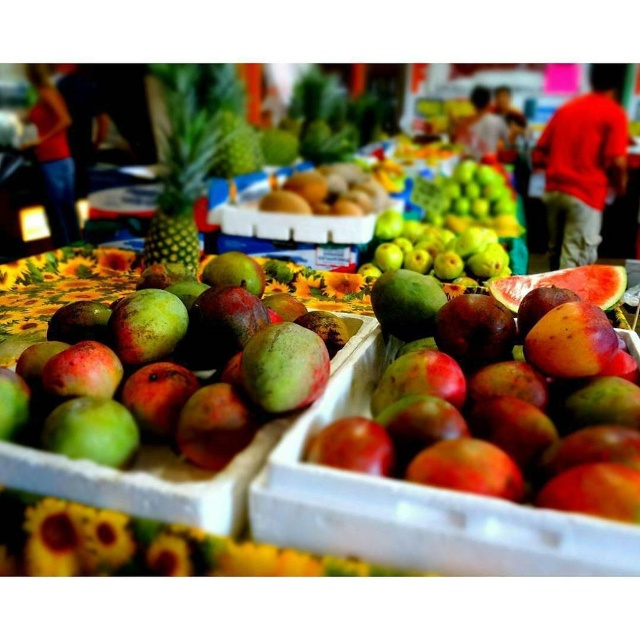
Question: Can you confirm if ripe mango at center is positioned to the right of green matte mango at center?

Choices:
 (A) no
 (B) yes

Answer: (B)

Question: Can you confirm if ripe mango at center is positioned to the left of green matte mango at center?

Choices:
 (A) no
 (B) yes

Answer: (A)

Question: Which point is closer to the camera?

Choices:
 (A) (365, 435)
 (B) (209, 323)

Answer: (A)

Question: Is ripe mango at center closer to the viewer compared to green matte mango at center?

Choices:
 (A) no
 (B) yes

Answer: (B)